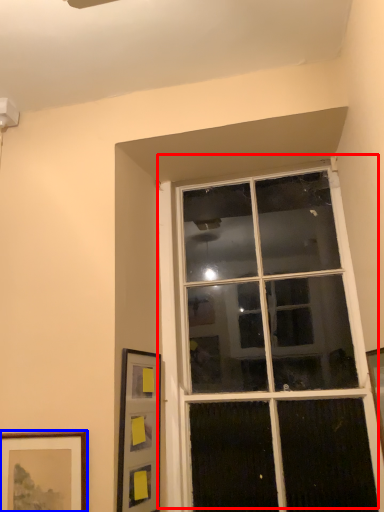
Question: Which point is closer to the camera, window (highlighted by a red box) or picture frame (highlighted by a blue box)?

Choices:
 (A) window
 (B) picture frame

Answer: (B)